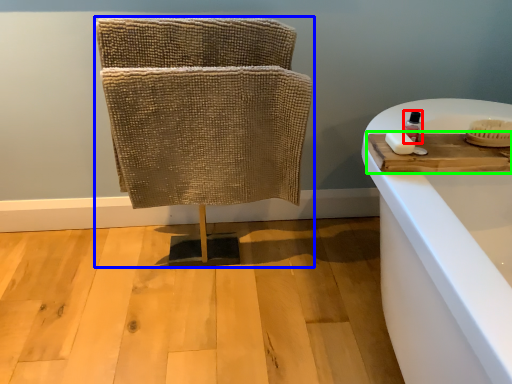
Question: Based on their relative distances, which object is nearer to toiletry (highlighted by a red box)? Choose from furniture (highlighted by a blue box) and wood (highlighted by a green box).

Choices:
 (A) furniture
 (B) wood

Answer: (B)